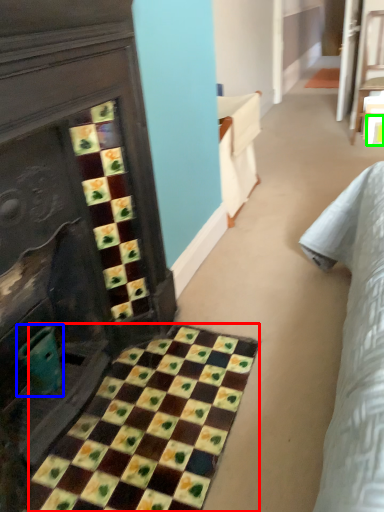
Question: Which object is the farthest from ceramic tile (highlighted by a red box)? Choose among these: teal (highlighted by a blue box) or square (highlighted by a green box).

Choices:
 (A) teal
 (B) square

Answer: (B)